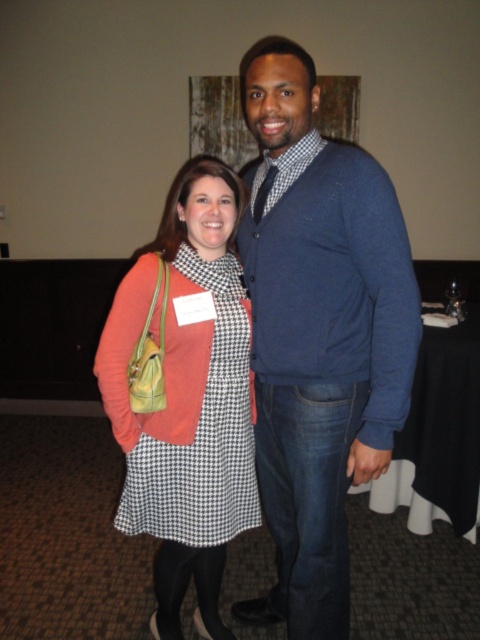
You are organizing a closet and have a shelf that can only hold items up to 18 inches in width. You need to place the blue sweater at center and the matte orange sweater at left on this shelf. Based on their widths, can both sweaters fit side by side?

The blue sweater at center might be wider than matte orange sweater at left. Since the total width of both could exceed 18 inches, it is uncertain if they will fit without overlapping. Check their exact measurements before placing them.

You are at a formal event and need to determine which point is closer to you. The points are labeled as point (336,186) and point (168,264). Which point is closer to you?

Point (336,186) is closer to the viewer than point (168,264).

You are standing in the middle of the room and want to hand a document to the person wearing the blue sweater at center. Which direction should you move to reach them?

The blue sweater at center is located at point coordinates of 0.527 on the x axis and 0.665 on the y axis, so you should move towards the direction of the coordinates to reach them.